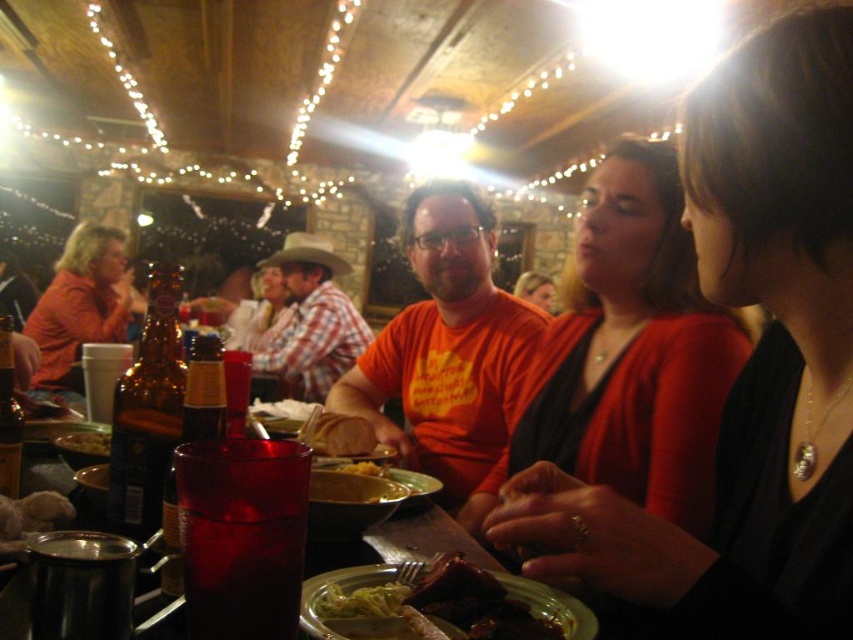
In the scene shown: Is translucent glass beer bottle at left thinner than yellow mashed potato at center?

No.

Which is more to the right, translucent glass beer bottle at left or yellow mashed potato at center?

yellow mashed potato at center

Does point (134, 381) come behind point (335, 468)?

No, (134, 381) is closer to viewer.

Image resolution: width=853 pixels, height=640 pixels. What are the coordinates of `translucent glass beer bottle at left` in the screenshot? It's located at (148, 412).

Between matte orange shirt at left and matte orange shirt at center, which one is positioned lower?

matte orange shirt at left

How far apart are matte orange shirt at left and matte orange shirt at center?

They are 2.42 meters apart.

Who is more forward, (67, 301) or (517, 284)?

Point (67, 301) is in front.

The width and height of the screenshot is (853, 640). Find the location of `matte orange shirt at left`. matte orange shirt at left is located at coordinates (80, 301).

Which is above, translucent glass at center or matte orange shirt at center?

matte orange shirt at center is higher up.

Is point (245, 634) less distant than point (520, 296)?

Yes, point (245, 634) is in front of point (520, 296).

The height and width of the screenshot is (640, 853). Identify the location of translucent glass at center. (242, 536).